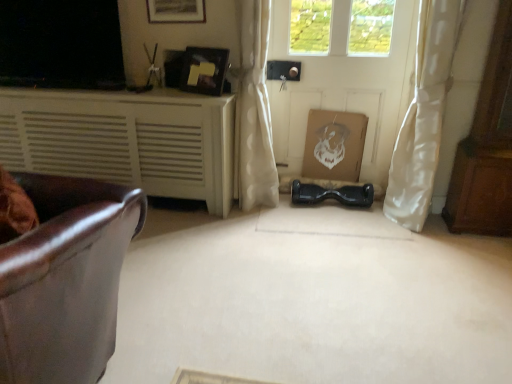
Question: Is brown wooden dresser at right wider or thinner than wooden picture frame at upper center, marked as the 1th picture frame in a top-to-bottom arrangement?

Choices:
 (A) thin
 (B) wide

Answer: (B)

Question: Considering their positions, is brown wooden dresser at right located in front of or behind wooden picture frame at upper center, marked as the 1th picture frame in a top-to-bottom arrangement?

Choices:
 (A) front
 (B) behind

Answer: (A)

Question: Which object is positioned farthest from the matte black hoverboard at center?

Choices:
 (A) white cardboard box at center
 (B) white matte cabinet at left
 (C) wooden picture frame at upper center, marked as the 1th picture frame in a top-to-bottom arrangement
 (D) matte black picture frame at upper center, the 1th picture frame ordered from the bottom
 (E) white matte door at center

Answer: (C)

Question: Which of these objects is positioned closest to the white matte door at center?

Choices:
 (A) white sheer curtain at right, the 1th curtain viewed from the right
 (B) white cardboard box at center
 (C) wooden picture frame at upper center, marked as the 1th picture frame in a top-to-bottom arrangement
 (D) white sheer curtain at center, placed as the second curtain when sorted from right to left
 (E) white matte cabinet at left

Answer: (B)